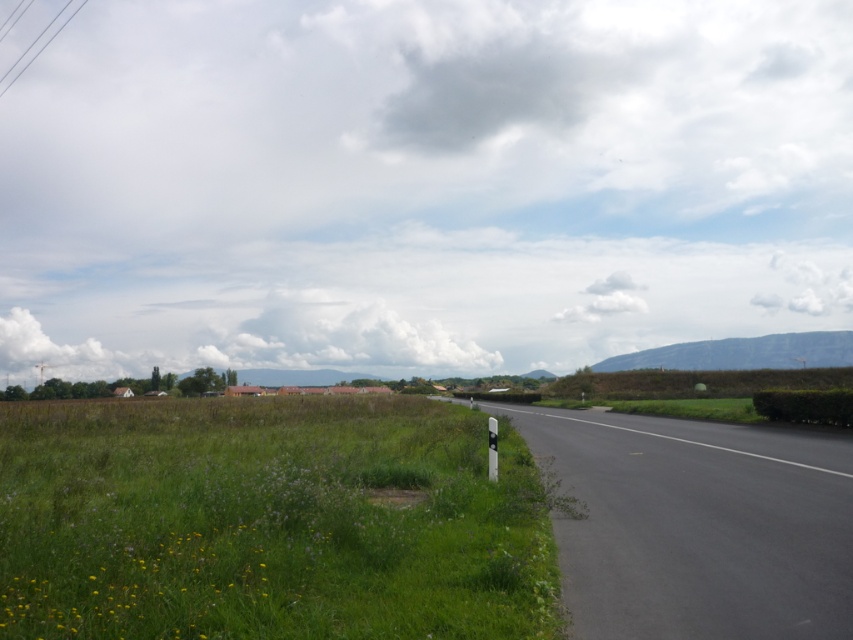
Question: Is green leafy hedge at right above white plastic sign at right?

Choices:
 (A) yes
 (B) no

Answer: (B)

Question: Which point appears closest to the camera in this image?

Choices:
 (A) (758, 403)
 (B) (218, 579)

Answer: (B)

Question: Which is farther from the green leafy hedge at right?

Choices:
 (A) black asphalt road at center
 (B) green grass at lower left
 (C) white plastic sign at right

Answer: (B)

Question: Is green grass at lower left below green leafy hedge at right?

Choices:
 (A) no
 (B) yes

Answer: (B)

Question: From the image, what is the correct spatial relationship of green grass at lower left in relation to green leafy hedge at right?

Choices:
 (A) above
 (B) below

Answer: (B)

Question: Considering the real-world distances, which object is farthest from the white plastic sign at right?

Choices:
 (A) green leafy hedge at right
 (B) black asphalt road at center
 (C) green grass at lower left

Answer: (A)